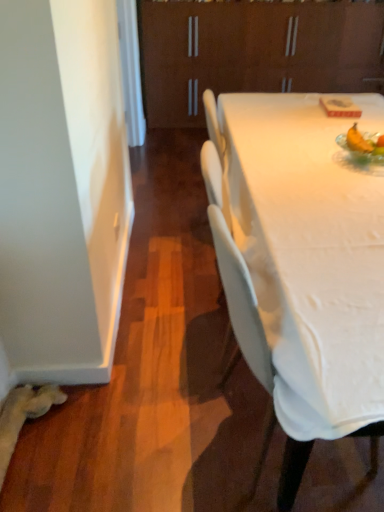
Locate an element on the screen. The image size is (384, 512). free space to the left of white plastic chair at center is located at coordinates coord(151,421).